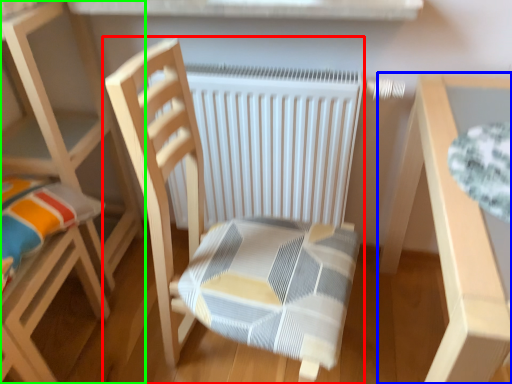
Question: Which object is the closest to the chair (highlighted by a red box)? Choose among these: table (highlighted by a blue box) or chair (highlighted by a green box).

Choices:
 (A) table
 (B) chair

Answer: (A)